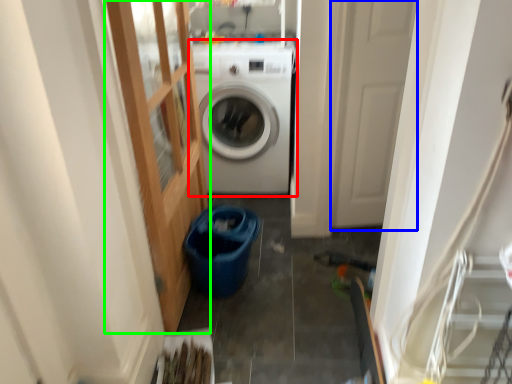
Question: Estimate the real-world distances between objects in this image. Which object is closer to washing machine (highlighted by a red box), screen door (highlighted by a blue box) or glass door (highlighted by a green box)?

Choices:
 (A) screen door
 (B) glass door

Answer: (B)